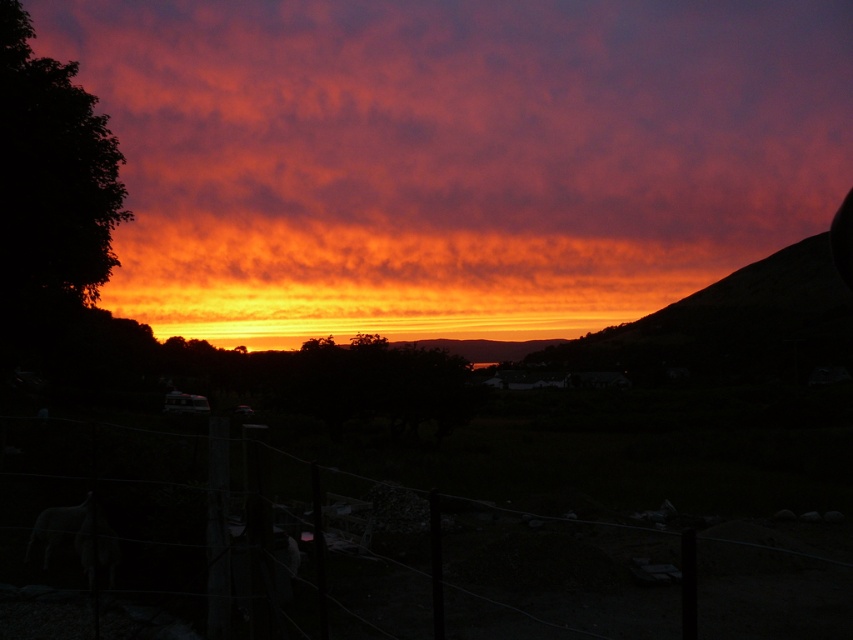
You are a photographer trying to capture the sunset. You notice the cloudy orange sky at upper center and the wire mesh fence at lower center in your viewfinder. Which object should you focus on first if you want to ensure both are in sharp focus?

You should focus on the cloudy orange sky at upper center first because it is located above the wire mesh fence at lower center, so adjusting focus starting from the sky will help ensure both are in sharp focus.

You are a photographer trying to capture the sunset. You have a camera with a wide enough lens to capture both the cloudy orange sky at upper center and the wire mesh fence at lower center in the same frame. Based on their positions, which object should you focus on first to ensure both are in sharp focus?

The wire mesh fence at lower center should be focused on first because it is closer to the photographer than the cloudy orange sky at upper center, which is further away. Focusing on the closer object ensures both are in focus due to the depth of field.

You are standing in front of the sunset scene and want to take a photo. You notice two points in the image labeled as point 1 and point 2. If point 1 is at coordinates point [463,298] and point 2 is at point [793,577], which point is closer to you when looking through the camera?

Point 1 at coordinates point [463,298] is closer to you than point 2 at point [793,577] because it is further to the camera.